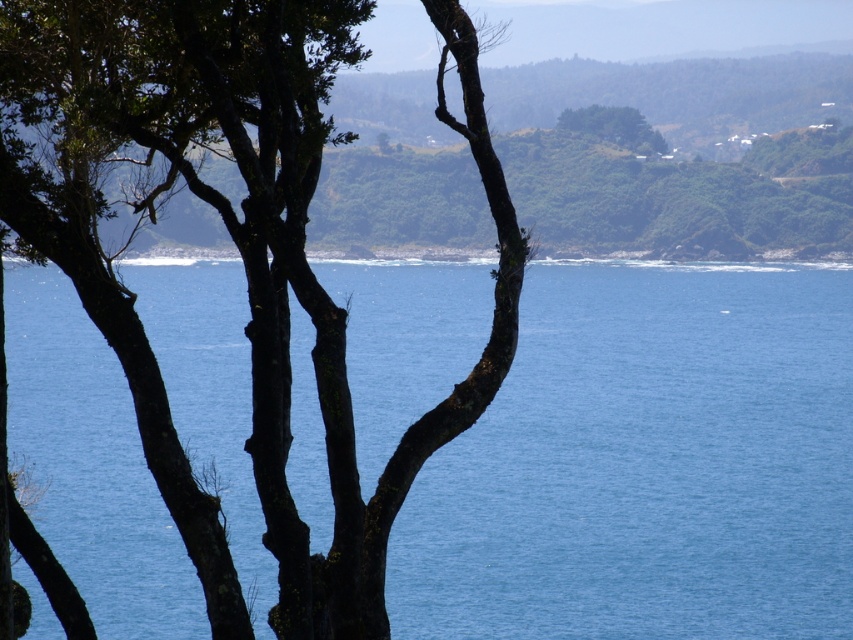
You are standing at the edge of the water in the coastal landscape. If you walk directly towards the point labeled as point (647,465), will you be walking into the water or onto the land?

The point (647,465) corresponds to blue water at center, so walking towards it would lead you into the water.

You are standing at the edge of the coastal landscape shown in the image. There is a point marked at coordinates (647, 465). Based on the scene description, what feature does this point most likely represent?

The point at coordinates (647, 465) corresponds to blue water at center, as described in the objects description.

You are standing on the beach and see the blue water at center and the green leafy tree at upper center. Which object is closer to the horizon?

The blue water at center is closer to the horizon than the green leafy tree at upper center because it is positioned below the tree, which is located at the upper part of the image.